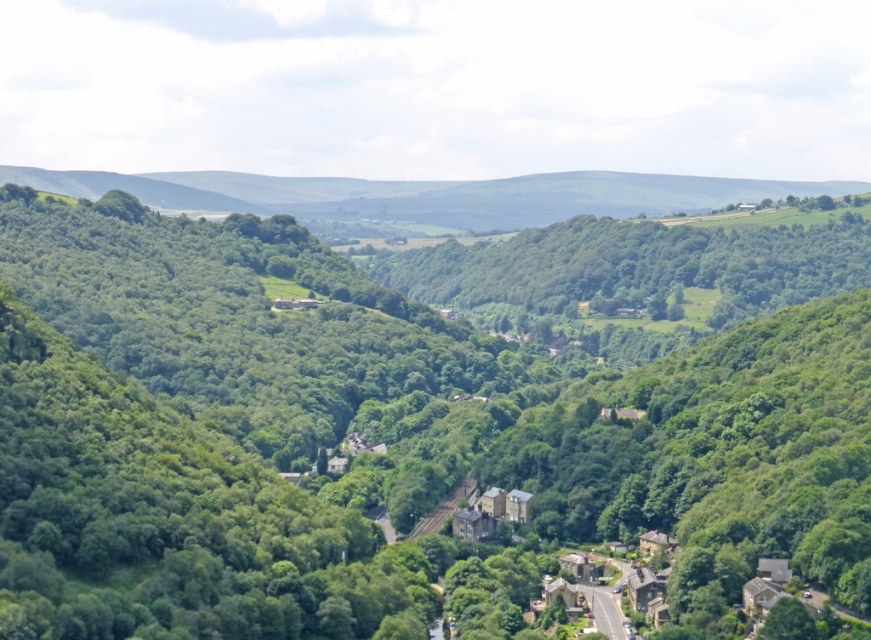
Who is more distant from viewer, (78, 369) or (657, 182)?

The point (657, 182) is more distant.

Between green leafy tree at center and green grassy hillside at upper center, which one has less height?

Standing shorter between the two is green grassy hillside at upper center.

Who is more distant from viewer, (534, 493) or (534, 188)?

The point (534, 188) is more distant.

Where is `green leafy tree at center`? The width and height of the screenshot is (871, 640). green leafy tree at center is located at coordinates (386, 433).